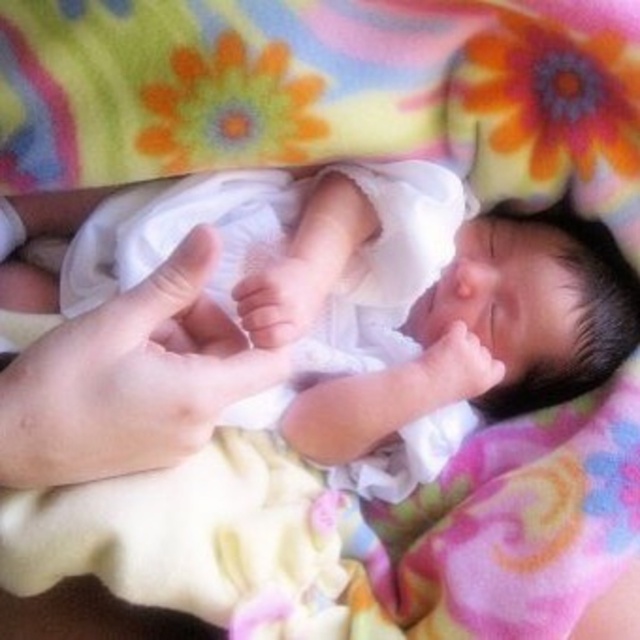
Between point (564, 321) and point (77, 420), which one is positioned behind?

Point (564, 321)

What do you see at coordinates (348, 300) in the screenshot?
I see `white soft cloth at center` at bounding box center [348, 300].

The image size is (640, 640). In order to click on white soft cloth at center in this screenshot , I will do `click(348, 300)`.